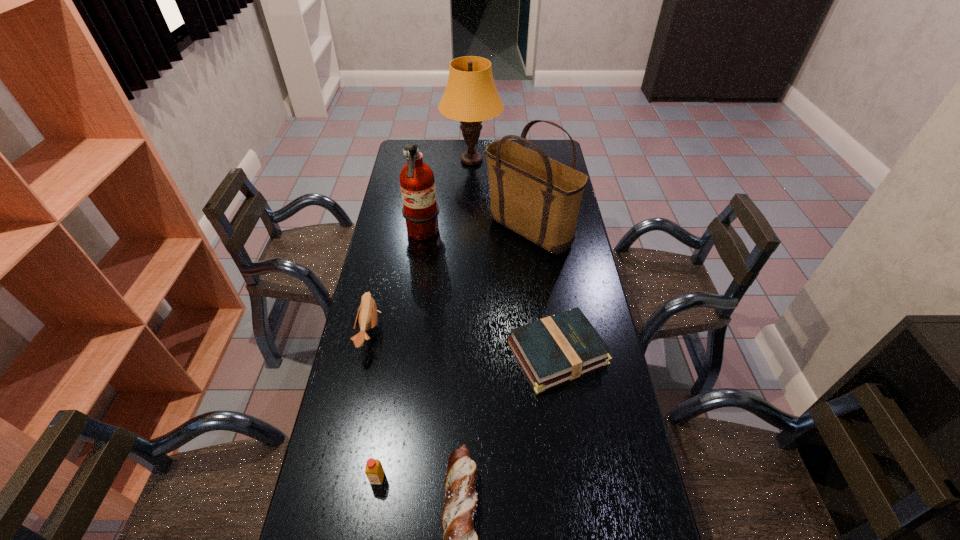
You are a GUI agent. You are given a task and a screenshot of the screen. Output one action in this format:
    pyautogui.click(x=<x>, y=<y>)
    Task: Click on the farthest object
    This screenshot has width=960, height=540.
    Given the screenshot: What is the action you would take?
    pyautogui.click(x=470, y=97)

Where is `tote bag`? tote bag is located at coordinates (537, 197).

Where is `fire extinguisher`? The width and height of the screenshot is (960, 540). fire extinguisher is located at coordinates (420, 210).

I want to click on bird, so click(x=367, y=316).

The height and width of the screenshot is (540, 960). Identify the location of the fifth tallest object. (374, 470).

Locate an element on the screen. hardback book is located at coordinates click(x=556, y=349).

Locate an element on the screen. The height and width of the screenshot is (540, 960). free space located 0.070m on the front of the lampshade is located at coordinates (471, 186).

The width and height of the screenshot is (960, 540). Identify the location of vacant point located on the front of the tote bag. (540, 325).

Identify the location of free space located on the nozzle and handle of the fire extinguisher. The height and width of the screenshot is (540, 960). (475, 234).

This screenshot has height=540, width=960. Identify the location of vacant space located at the beak of the leftmost object. (404, 333).